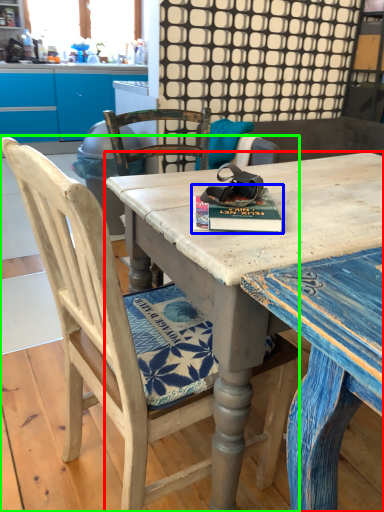
Question: Considering the real-world distances, which object is closest to desk (highlighted by a red box)? paperback book (highlighted by a blue box) or chair (highlighted by a green box).

Choices:
 (A) paperback book
 (B) chair

Answer: (A)